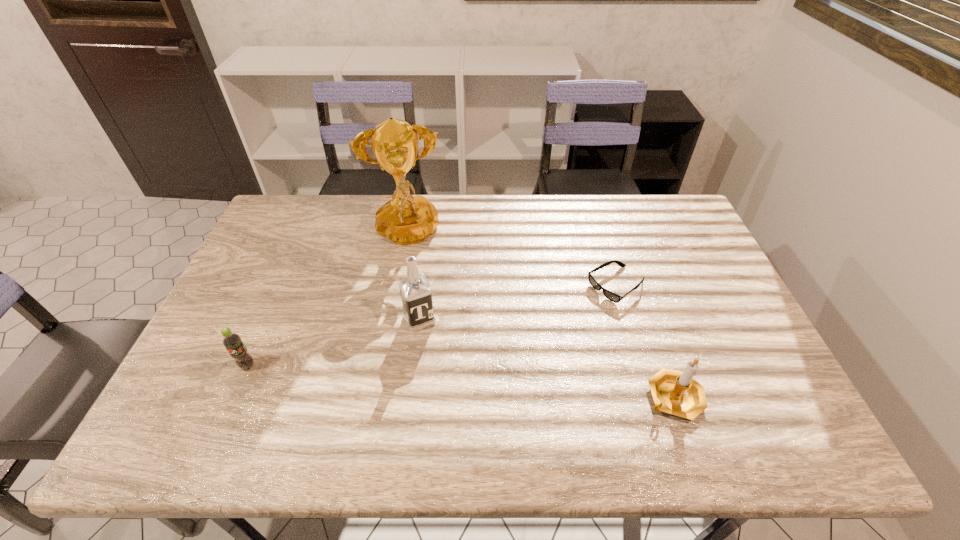
Locate an element on the screen. The width and height of the screenshot is (960, 540). free space between the sunglasses and the award is located at coordinates (512, 261).

I want to click on vacant space that's between the leftmost object and the second tallest object, so click(334, 342).

Locate an element on the screen. Image resolution: width=960 pixels, height=540 pixels. blank region between the candle holder and the leftmost object is located at coordinates (461, 382).

Choose which object is the nearest neighbor to the tallest object. Please provide its 2D coordinates. Your answer should be formatted as a tuple, i.e. [(x, y)], where the tuple contains the x and y coordinates of a point satisfying the conditions above.

[(416, 293)]

I want to click on object that is the nearest to the soda, so (x=416, y=293).

This screenshot has height=540, width=960. In order to click on free point that satisfies the following two spatial constraints: 1. on the front side of the second tallest object; 2. on the right side of the award in this screenshot , I will do `click(391, 319)`.